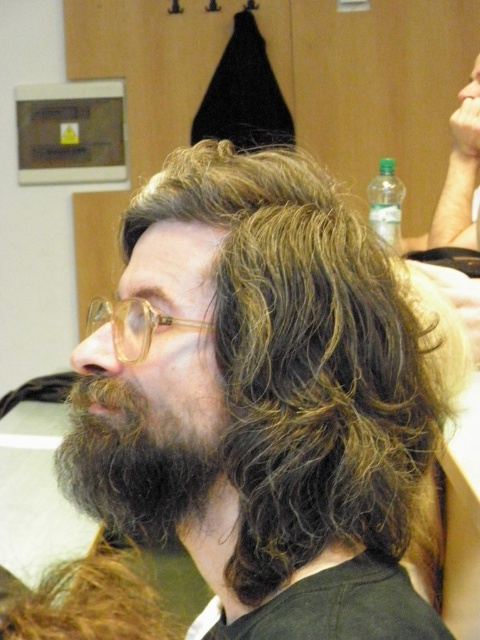
You are a photographer adjusting your camera settings to capture the person in the scene. You need to ensure both the dark brown fuzzy beard at lower left and the translucent plastic glasses at left are in focus. Given that the depth of field can only sharply focus on one object at a time, which object should you prioritize focusing on to ensure it appears clearer in the photo?

The dark brown fuzzy beard at lower left has a greater height compared to the translucent plastic glasses at left, so you should prioritize focusing on the dark brown fuzzy beard at lower left to ensure it appears clearer in the photo.

You are a photographer setting up a portrait session. You need to ensure that the dark brown wavy hair at center and the translucent plastic glasses at left are both visible in the frame. Given their sizes, which object should you focus on to ensure both are in focus?

The dark brown wavy hair at center is larger in size than the translucent plastic glasses at left, so focusing on the dark brown wavy hair at center would ensure both are in focus as it is the larger subject.